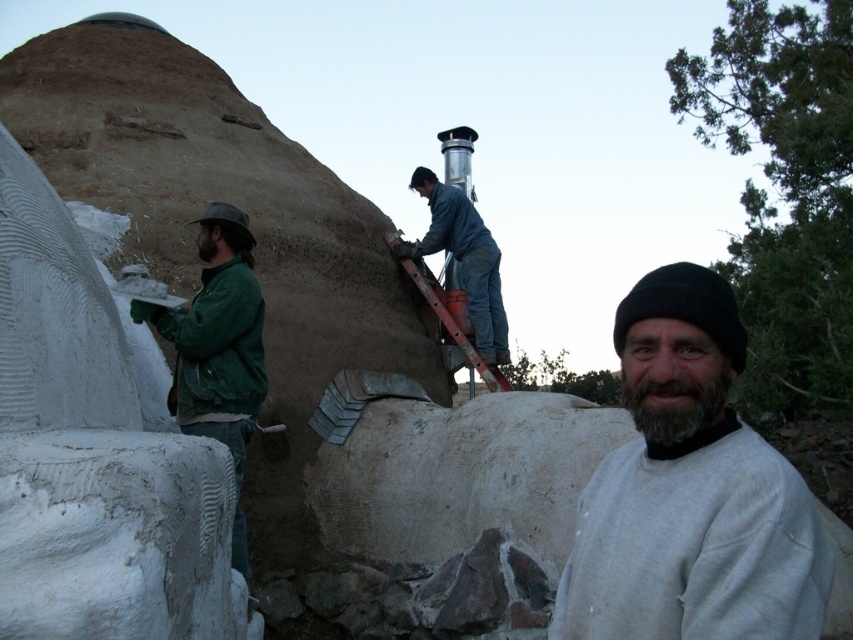
What are the coordinates of the gray cotton sweatshirt at center?

The coordinates of the gray cotton sweatshirt at center are at point (689, 492).

Based on the photo, you are a safety inspector observing the construction site. You notice two workers wearing the gray cotton sweatshirt at center and the green matte jacket at left. According to safety regulations, all workers must wear jackets that reach below the waist. Can both workers comply with this requirement based on their current attire?

The gray cotton sweatshirt at center is shorter than the green matte jacket at left. Since the gray cotton sweatshirt at center is shorter, it may not reach below the waist, whereas the green matte jacket at left is longer and likely complies. Therefore, only the worker in the green matte jacket at left meets the requirement.